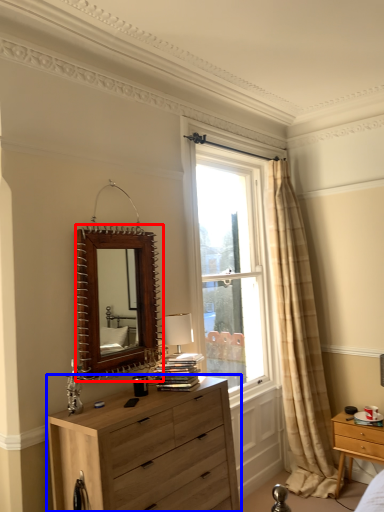
Question: Which object appears farthest to the camera in this image, mirror (highlighted by a red box) or chest of drawers (highlighted by a blue box)?

Choices:
 (A) mirror
 (B) chest of drawers

Answer: (A)